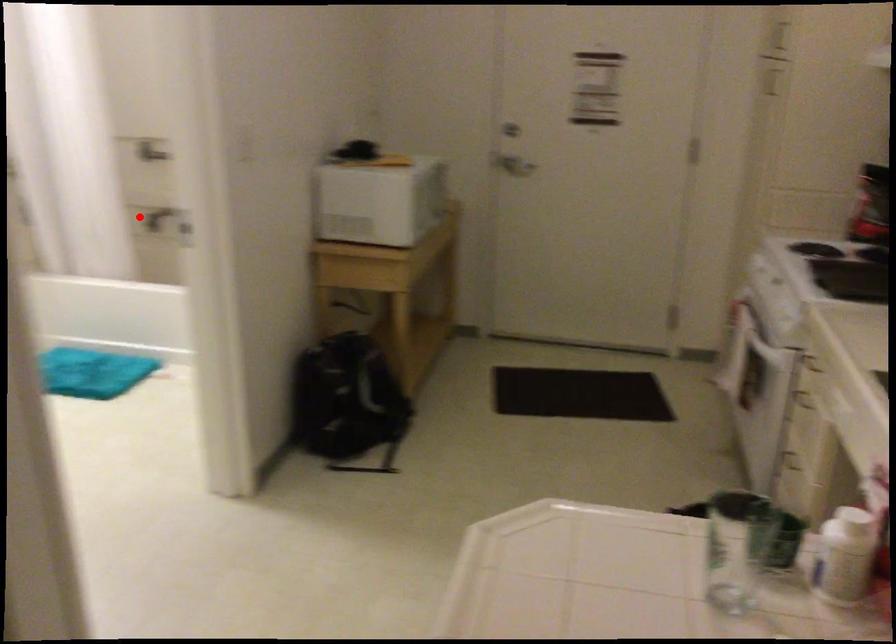
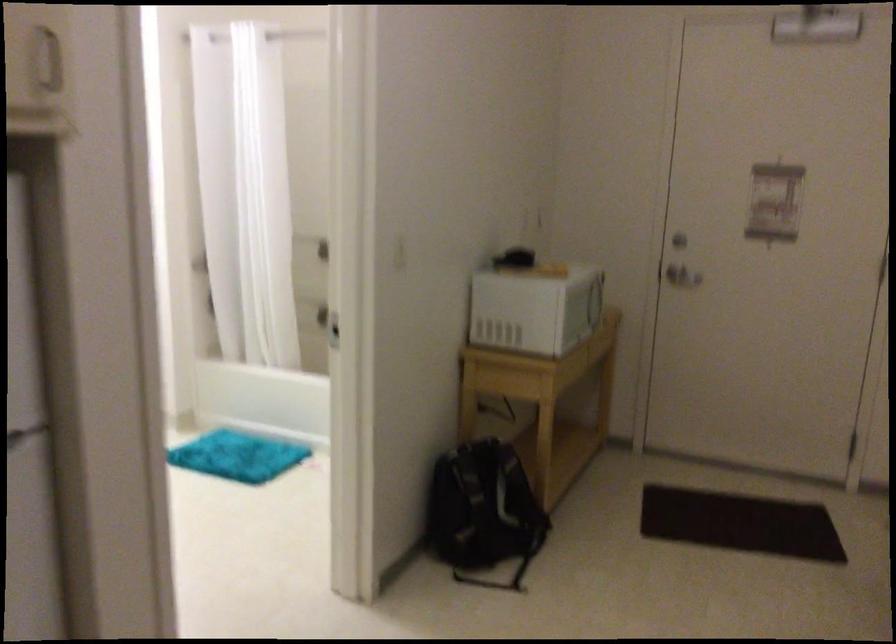
Locate, in the second image, the point that corresponds to the highlighted location in the first image.

(312, 310)